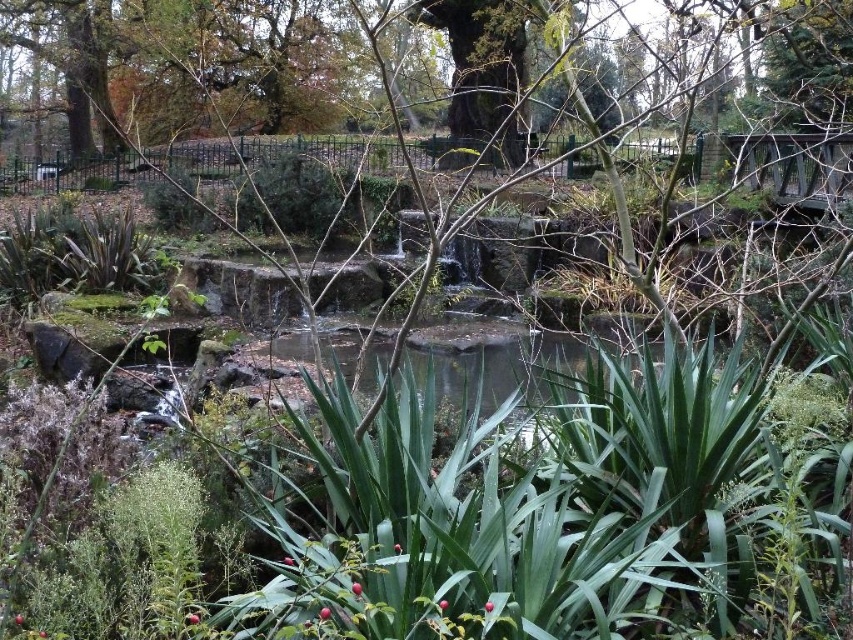
Is green mossy tree at upper center shorter than green mossy pond at center?

No.

Does green mossy tree at upper center have a smaller size compared to green mossy pond at center?

No.

Between point (321, 118) and point (412, 358), which one is positioned in front?

Point (412, 358) is more forward.

This screenshot has width=853, height=640. I want to click on green mossy tree at upper center, so [190, 58].